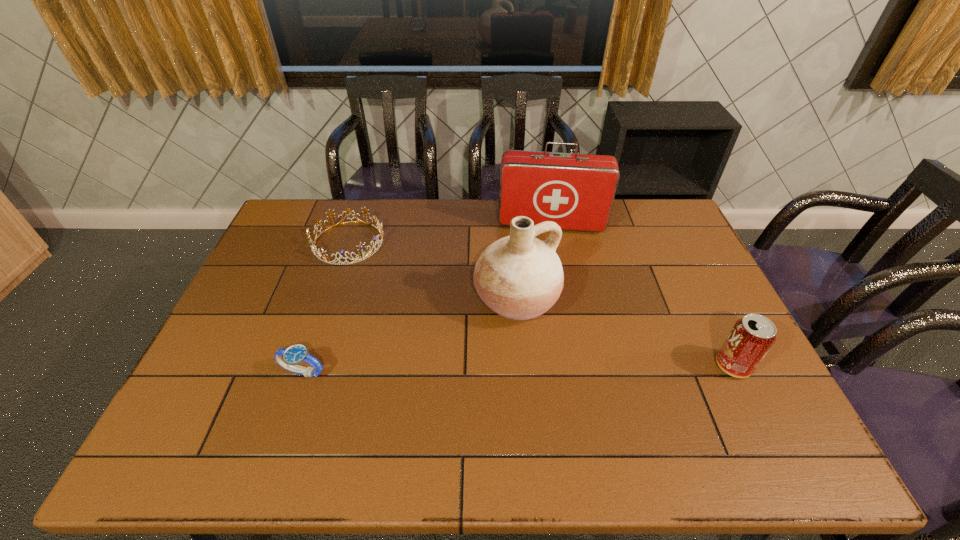
You are a GUI agent. You are given a task and a screenshot of the screen. Output one action in this format:
    pyautogui.click(x=<x>, y=<y>)
    Task: Click on the vacant space positioned 0.260m to pour from the handle of the pottery
    
    Given the screenshot: What is the action you would take?
    pyautogui.click(x=597, y=402)

Image resolution: width=960 pixels, height=540 pixels. Find the location of `vacant space located 0.220m on the side of the first-aid kit with the first aid cross symbol`. vacant space located 0.220m on the side of the first-aid kit with the first aid cross symbol is located at coordinates (547, 279).

Where is `blank space located on the side of the first-aid kit with the first aid cross symbol`? Image resolution: width=960 pixels, height=540 pixels. blank space located on the side of the first-aid kit with the first aid cross symbol is located at coordinates (547, 284).

In order to click on free space located 0.200m on the side of the first-aid kit with the first aid cross symbol in this screenshot , I will do `click(547, 275)`.

At what (x,y) coordinates should I click in order to perform the action: click on vacant space located on the front-facing side of the tiara. Please return your answer as a coordinate pair (x, y). The image size is (960, 540). Looking at the image, I should click on (414, 318).

I want to click on free spot located on the front-facing side of the tiara, so click(x=414, y=318).

Find the location of a particular element. This screenshot has width=960, height=540. free space located 0.250m on the front-facing side of the tiara is located at coordinates (403, 306).

Where is `the first-aid kit at the far edge`? the first-aid kit at the far edge is located at coordinates (576, 191).

The height and width of the screenshot is (540, 960). I want to click on tiara present at the far edge, so click(321, 252).

The image size is (960, 540). What are the coordinates of `object that is at the left edge` in the screenshot? It's located at (321, 252).